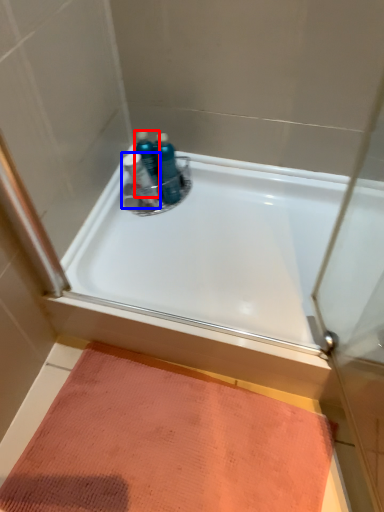
Question: Which object appears farthest to the camera in this image, toiletry (highlighted by a red box) or toiletry (highlighted by a blue box)?

Choices:
 (A) toiletry
 (B) toiletry

Answer: (A)